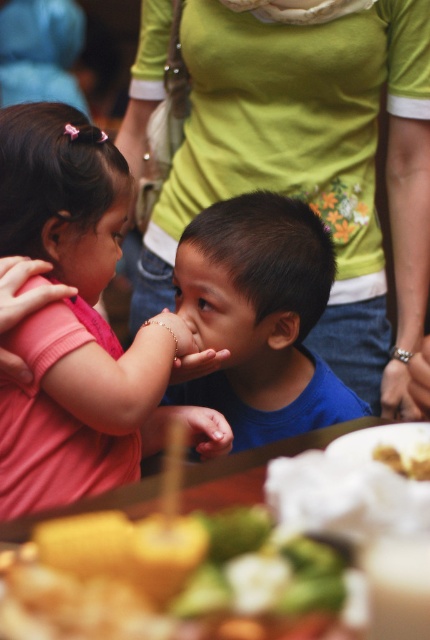
Can you confirm if green fabric shirt at center is taller than pink matte shirt at left?

Indeed, green fabric shirt at center has a greater height compared to pink matte shirt at left.

Is green fabric shirt at center bigger than pink matte shirt at left?

Correct, green fabric shirt at center is larger in size than pink matte shirt at left.

Between point (200, 134) and point (73, 492), which one is positioned behind?

The point (200, 134) is more distant.

Find the location of a particular element. green fabric shirt at center is located at coordinates (312, 157).

Does green fabric shirt at center come behind yellow crumbly bread at lower right?

Yes, it is.

This screenshot has width=430, height=640. I want to click on green fabric shirt at center, so click(x=312, y=157).

Is point (288, 154) positioned before point (378, 445)?

No, (288, 154) is behind (378, 445).

This screenshot has width=430, height=640. What are the coordinates of `green fabric shirt at center` in the screenshot? It's located at (312, 157).

Between blue matte shirt at center and yellow crumbly bread at lower right, which one is positioned lower?

yellow crumbly bread at lower right

Describe the element at coordinates (261, 316) in the screenshot. I see `blue matte shirt at center` at that location.

Which is in front, point (237, 301) or point (387, 448)?

Positioned in front is point (387, 448).

Locate an element on the screen. The width and height of the screenshot is (430, 640). blue matte shirt at center is located at coordinates (261, 316).